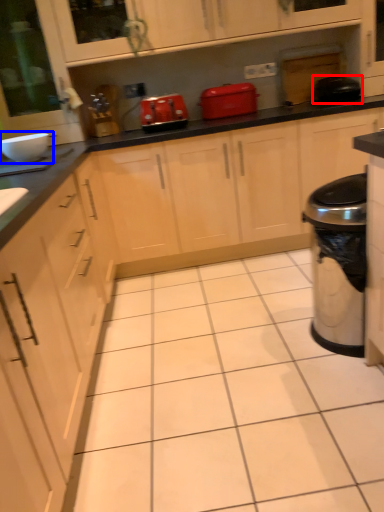
Question: Which object appears farthest to the camera in this image, appliance (highlighted by a red box) or appliance (highlighted by a blue box)?

Choices:
 (A) appliance
 (B) appliance

Answer: (A)